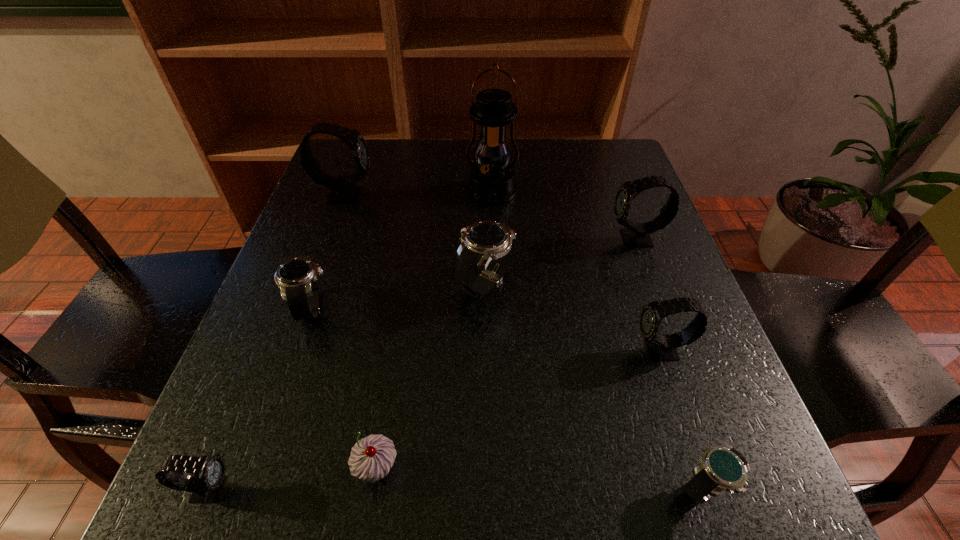
The image size is (960, 540). What are the coordinates of `free space between the second smallest silver watch and the biggest gray watch` in the screenshot? It's located at (329, 251).

Where is `free area in between the smallest silver watch and the smallest gray watch`? free area in between the smallest silver watch and the smallest gray watch is located at coordinates (457, 488).

Locate which object is the seventh closest to the lantern. Please provide its 2D coordinates. Your answer should be formatted as a tuple, i.e. [(x, y)], where the tuple contains the x and y coordinates of a point satisfying the conditions above.

[(725, 468)]

You are a GUI agent. You are given a task and a screenshot of the screen. Output one action in this format:
    pyautogui.click(x=<x>, y=<y>)
    Task: Click on the object that is the seventh closest to the second nearest gray watch
    This screenshot has width=960, height=540.
    Given the screenshot: What is the action you would take?
    pyautogui.click(x=205, y=485)

Locate which watch is the fourth closest to the biggest gray watch. Please provide its 2D coordinates. Your answer should be formatted as a tuple, i.e. [(x, y)], where the tuple contains the x and y coordinates of a point satisfying the conditions above.

[(205, 485)]

Identify which watch is located as the seventh nearest to the lantern. Please provide its 2D coordinates. Your answer should be formatted as a tuple, i.e. [(x, y)], where the tuple contains the x and y coordinates of a point satisfying the conditions above.

[(205, 485)]

Locate which gray watch ranks third in proximity to the second tallest object. Please provide its 2D coordinates. Your answer should be formatted as a tuple, i.e. [(x, y)], where the tuple contains the x and y coordinates of a point satisfying the conditions above.

[(661, 347)]

I want to click on gray watch that stands as the third closest to the farthest watch, so click(661, 347).

Locate an element on the screen. The width and height of the screenshot is (960, 540). silver watch that stands as the third closest to the lantern is located at coordinates (725, 468).

Locate which silver watch is the second closest to the fourth nearest object. Please provide its 2D coordinates. Your answer should be formatted as a tuple, i.e. [(x, y)], where the tuple contains the x and y coordinates of a point satisfying the conditions above.

[(482, 242)]